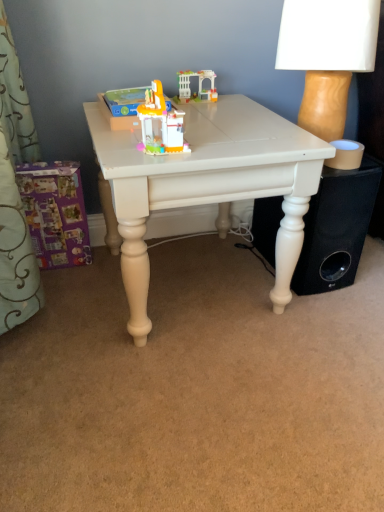
Question: From the image's perspective, is purple cardboard box at lower left, arranged as the first toy when viewed from the left, above or below black matte speaker at lower right?

Choices:
 (A) above
 (B) below

Answer: (B)

Question: Is purple cardboard box at lower left, acting as the 2th toy starting from the back, inside the boundaries of black matte speaker at lower right, or outside?

Choices:
 (A) outside
 (B) inside

Answer: (A)

Question: Considering the real-world distances, which object is closest to the purple cardboard box at lower left, which is the fourth toy from top to bottom?

Choices:
 (A) translucent plastic toy at center, which is the 2th toy from right to left
 (B) translucent plastic toy at center, arranged as the 3th toy when ordered from the bottom
 (C) white plastic arch at center, positioned as the 4th toy in front-to-back order
 (D) black matte speaker at lower right
 (E) wooden table lamp at upper right

Answer: (B)

Question: Which object is positioned closest to the black matte speaker at lower right?

Choices:
 (A) white plastic arch at center, positioned as the 4th toy in front-to-back order
 (B) translucent plastic toy at center, which is counted as the 3th toy, starting from the right
 (C) white painted wood table at center
 (D) wooden table lamp at upper right
 (E) purple cardboard box at lower left, which is the fourth toy from top to bottom

Answer: (C)